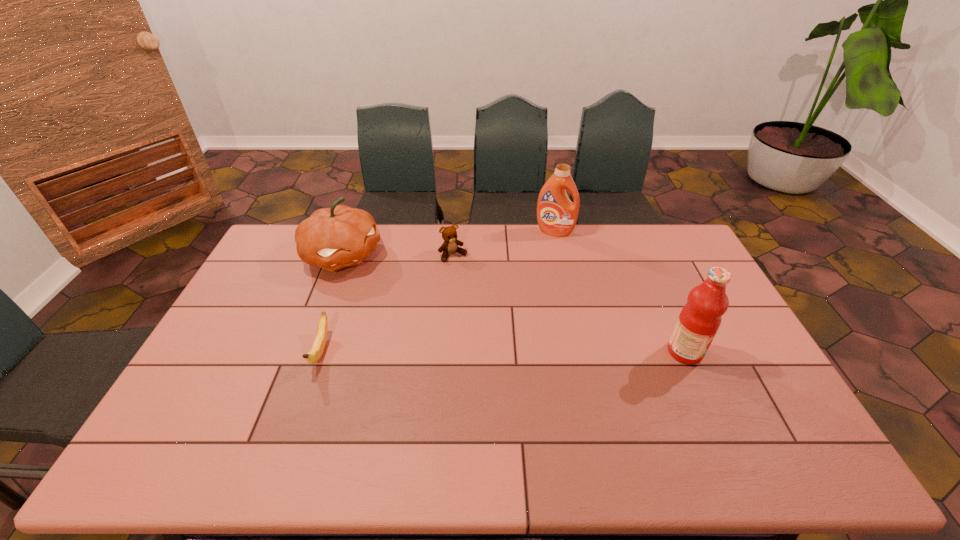
The width and height of the screenshot is (960, 540). What are the coordinates of `vacant position in the image that satisfies the following two spatial constraints: 1. on the front side of the detergent; 2. on the front label of the fruit juice` in the screenshot? It's located at (581, 352).